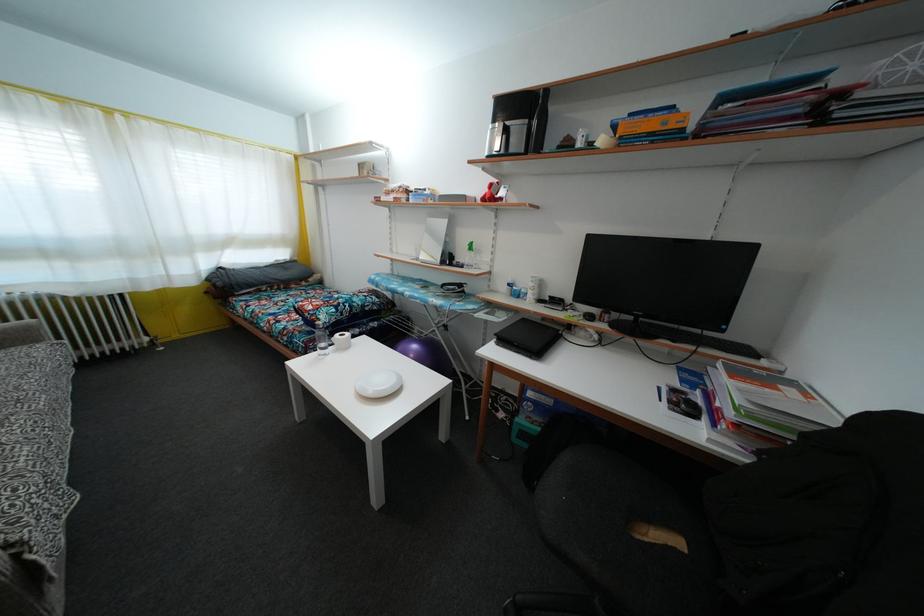
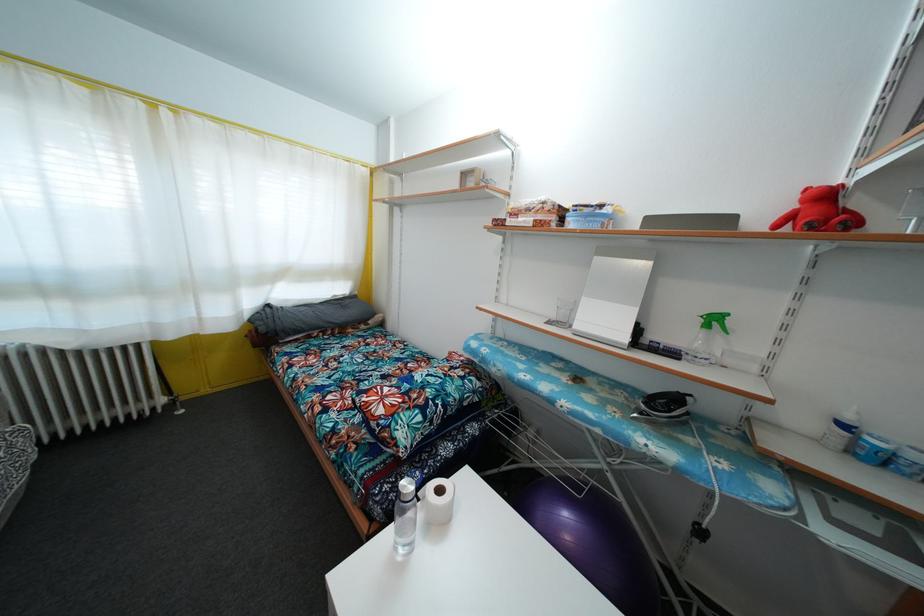
Locate, in the second image, the point that corresponds to the point at 299,265 in the first image.

(359, 300)